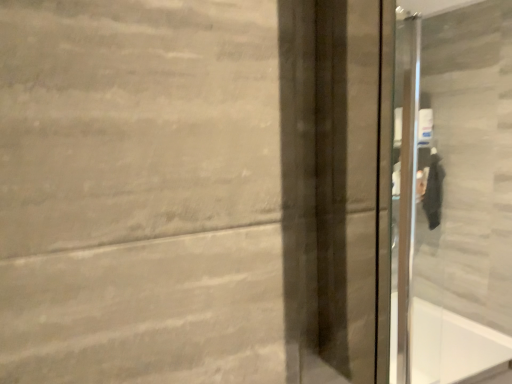
This screenshot has height=384, width=512. I want to click on metallic silver elevator door at center, so [452, 197].

Image resolution: width=512 pixels, height=384 pixels. What do you see at coordinates (452, 197) in the screenshot?
I see `metallic silver elevator door at center` at bounding box center [452, 197].

Identify the location of metallic silver elevator door at center. (452, 197).